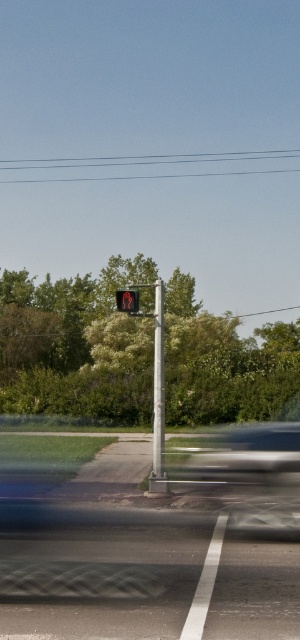
Can you confirm if silver metallic pole at center is shorter than red matte pedestrian signal at center?

No.

Does silver metallic pole at center have a greater width compared to red matte pedestrian signal at center?

Indeed, silver metallic pole at center has a greater width compared to red matte pedestrian signal at center.

Between point (158, 410) and point (126, 301), which one is positioned behind?

The point (158, 410) is behind.

At what (x,y) coordinates should I click in order to perform the action: click on silver metallic pole at center. Please return your answer as a coordinate pair (x, y). The image size is (300, 640). Looking at the image, I should click on (158, 397).